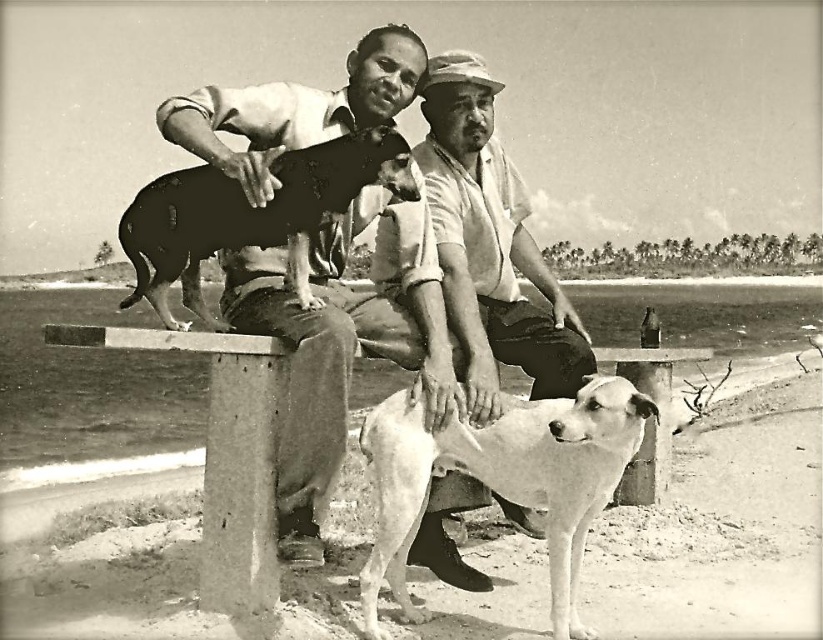
You are standing in front of the beach scene photograph and want to determine which of the two points, point (405, 596) or point (473, 435), is closer to you. Based on the image, which point is nearer?

Point (405, 596) is closer to you because it is further to the viewer than point (473, 435).

You are planning to bring a small folding chair that can seat one person. You see the metallic bench at center and the white smooth dog at center in the image. Which object can the chair fit next to without overlapping?

The metallic bench at center has a smaller size compared to the white smooth dog at center, so the chair can fit next to the metallic bench at center since it is smaller and has more space available.

You are a photographer standing in front of the image. You need to determine the spatial relationship between the smooth white shirt at center and the concrete bench at center. Which one is positioned higher?

The smooth white shirt at center is above the concrete bench at center, so it is positioned higher.